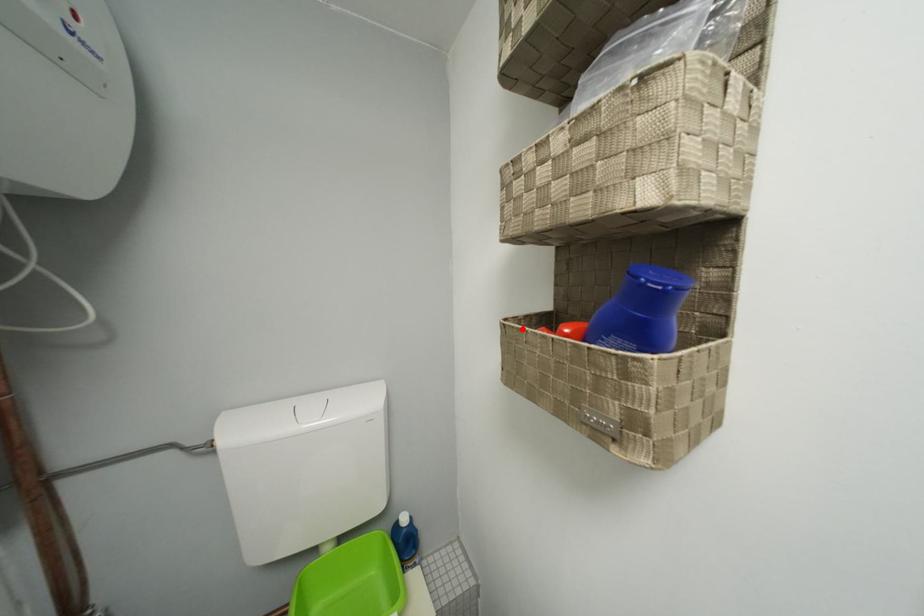
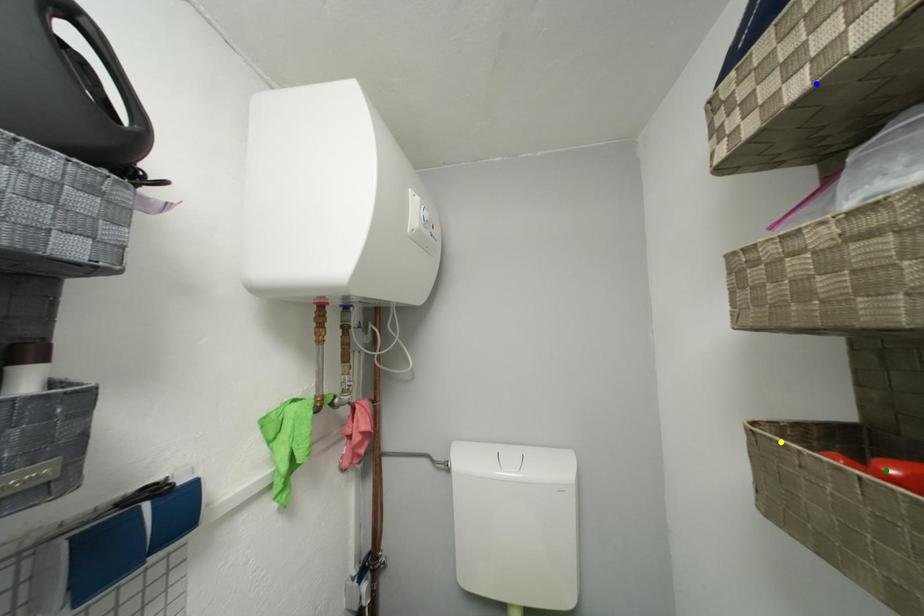
Question: I am providing you with two images of the same scene from different viewpoints. A red point is marked on the first image. You are given multiple points on the second image. Which point in image 2 is actually the same real-world point as the red point in image 1?

Choices:
 (A) yellow point
 (B) blue point
 (C) green point

Answer: (A)